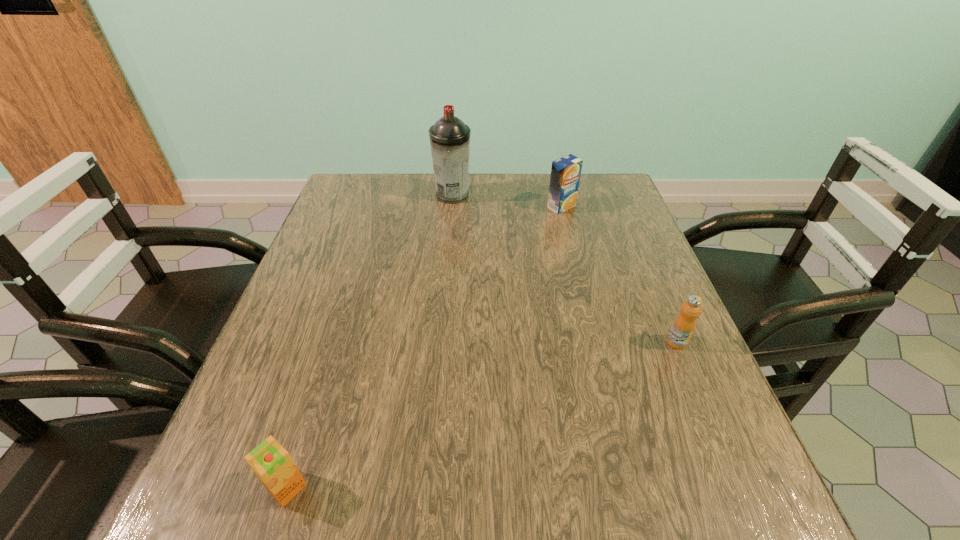
The image size is (960, 540). In order to click on free space located 0.330m on the front label of the rightmost orange juice in this screenshot , I will do `click(758, 535)`.

At what (x,y) coordinates should I click in order to perform the action: click on blank space located 0.250m on the right of the nearest object. Please return your answer as a coordinate pair (x, y). This screenshot has height=540, width=960. Looking at the image, I should click on (470, 487).

Identify the location of aerosol can present at the far edge. This screenshot has height=540, width=960. (449, 137).

Locate an element on the screen. This screenshot has height=540, width=960. orange_juice present at the far edge is located at coordinates (565, 173).

The image size is (960, 540). Find the location of `object that is at the near edge`. object that is at the near edge is located at coordinates (270, 461).

Where is `object that is at the left edge`? object that is at the left edge is located at coordinates (270, 461).

Find the location of a particular element. Image resolution: width=960 pixels, height=540 pixels. object located at the near left corner is located at coordinates (270, 461).

Where is `object that is positioned at the far right corner`? Image resolution: width=960 pixels, height=540 pixels. object that is positioned at the far right corner is located at coordinates (565, 173).

Where is `vacant position at the far edge of the desktop`? vacant position at the far edge of the desktop is located at coordinates (479, 217).

Identify the location of vacant space at the left edge of the desktop. Image resolution: width=960 pixels, height=540 pixels. click(269, 370).